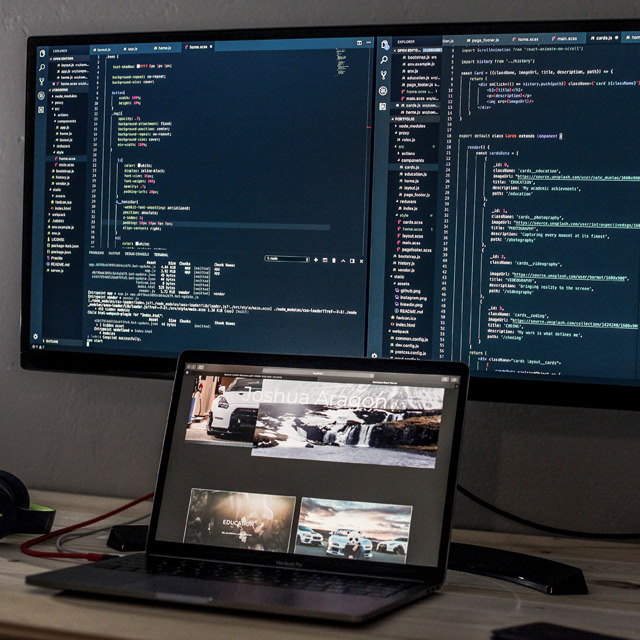
Locate an element on the screen. This screenshot has width=640, height=640. keyboard is located at coordinates (331, 584).